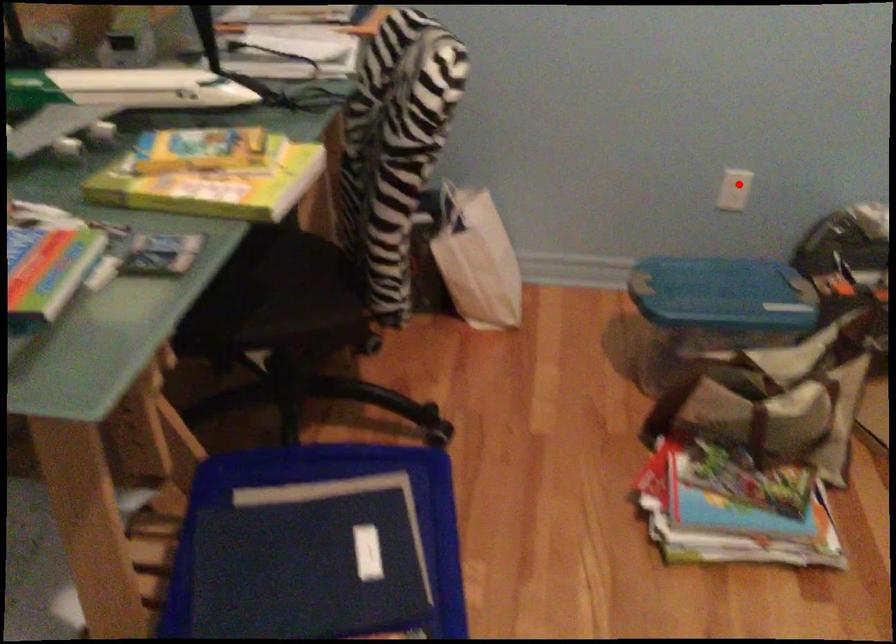
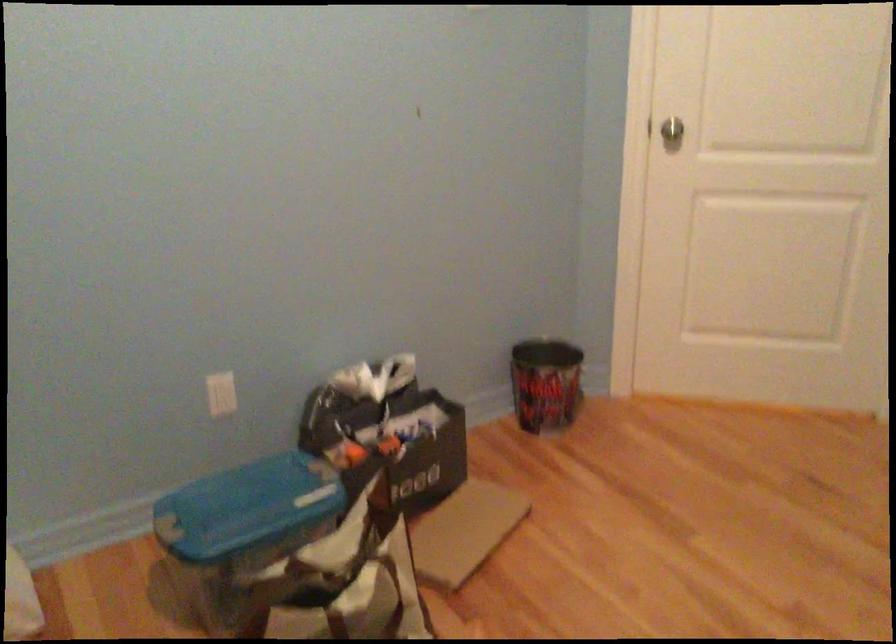
In the second image, find the point that corresponds to the highlighted location in the first image.

(220, 393)